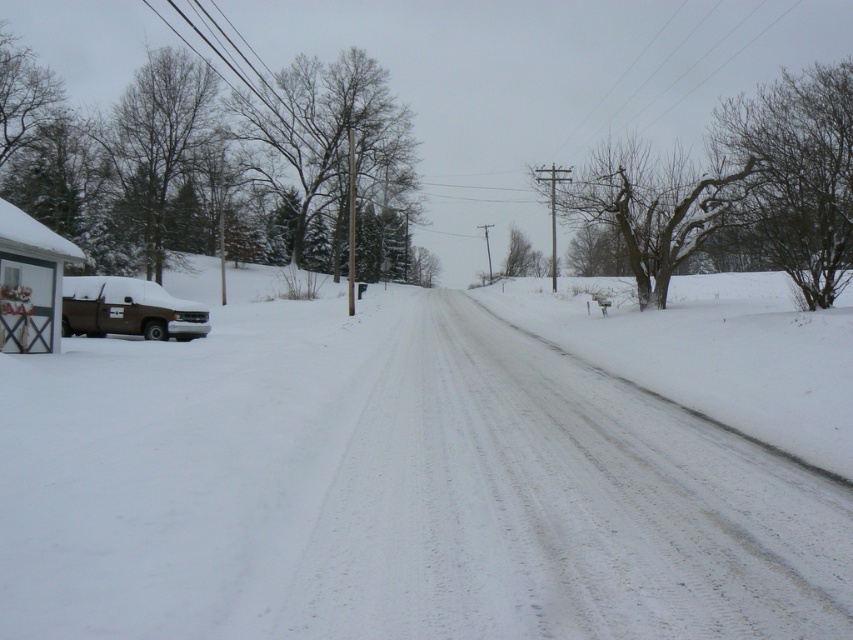
Who is positioned more to the left, white powdery snow at left or brown matte truck at left?

brown matte truck at left

I want to click on white powdery snow at left, so click(x=392, y=490).

Locate an element on the screen. Image resolution: width=853 pixels, height=640 pixels. white powdery snow at left is located at coordinates (392, 490).